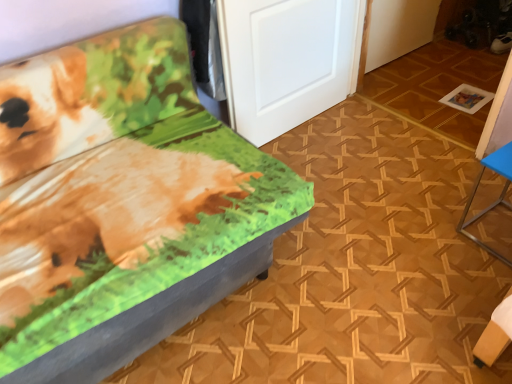
The width and height of the screenshot is (512, 384). Find the location of `free point to the right of printed fabric bench at left, the first furniture from the left`. free point to the right of printed fabric bench at left, the first furniture from the left is located at coordinates (366, 246).